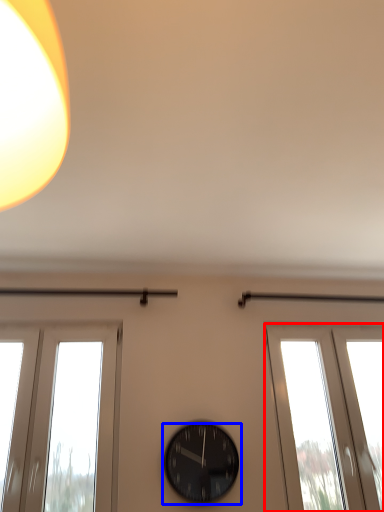
Question: Which point is further to the camera, window (highlighted by a red box) or wall clock (highlighted by a blue box)?

Choices:
 (A) window
 (B) wall clock

Answer: (A)